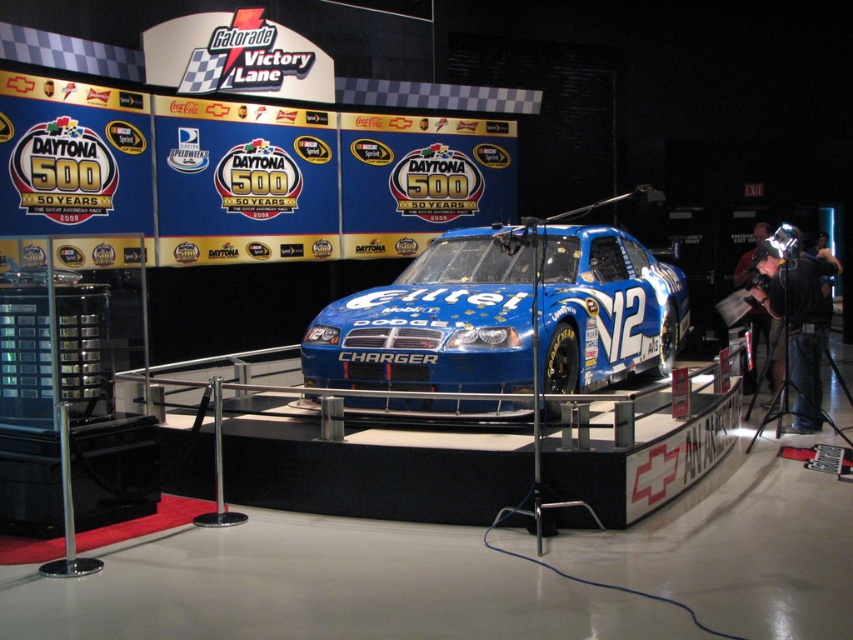
Between blue glossy charger at center and black leather jacket at right, which one is positioned higher?

blue glossy charger at center is above.

Can you confirm if blue glossy charger at center is positioned to the left of black leather jacket at right?

Yes, blue glossy charger at center is to the left of black leather jacket at right.

Who is more distant from viewer, (490,252) or (769,372)?

The point (769,372) is more distant.

Where is `blue glossy charger at center`? This screenshot has height=640, width=853. blue glossy charger at center is located at coordinates (432, 323).

Who is more forward, [772,314] or [764,316]?

Point [772,314] is more forward.

Which of these two, black fabric camera at right or black leather jacket at right, stands shorter?

Standing shorter between the two is black leather jacket at right.

Find the location of `black fabric camera at right`. black fabric camera at right is located at coordinates (798, 316).

Which is behind, point (645, 344) or point (759, 300)?

The point (759, 300) is more distant.

Which of these two, blue glossy charger at center or black fabric camera at right, stands taller?

Standing taller between the two is black fabric camera at right.

Is point (358, 371) in front of point (804, 285)?

Yes, it is.

Identify the location of blue glossy charger at center. (432, 323).